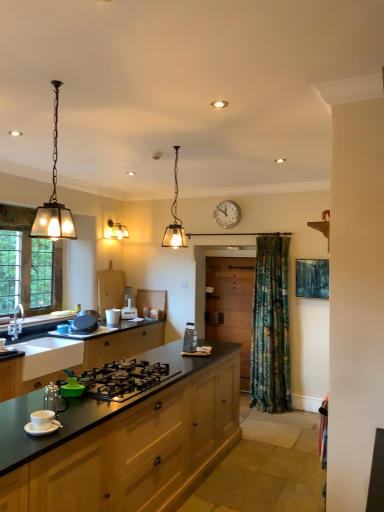
Find the location of a particular element. Image resolution: width=384 pixels, height=512 pixels. vacant space situated on the left part of white ceramic cup at lower left, arranged as the 4th appliance when viewed from the left is located at coordinates (11, 425).